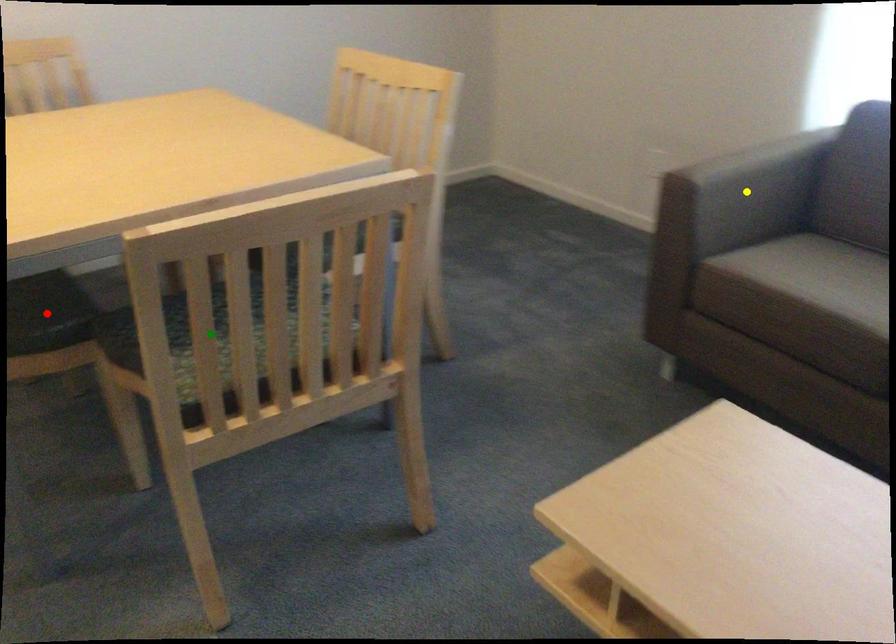
Order these from farthest to nearest:
- green point
- yellow point
- red point

yellow point → red point → green point